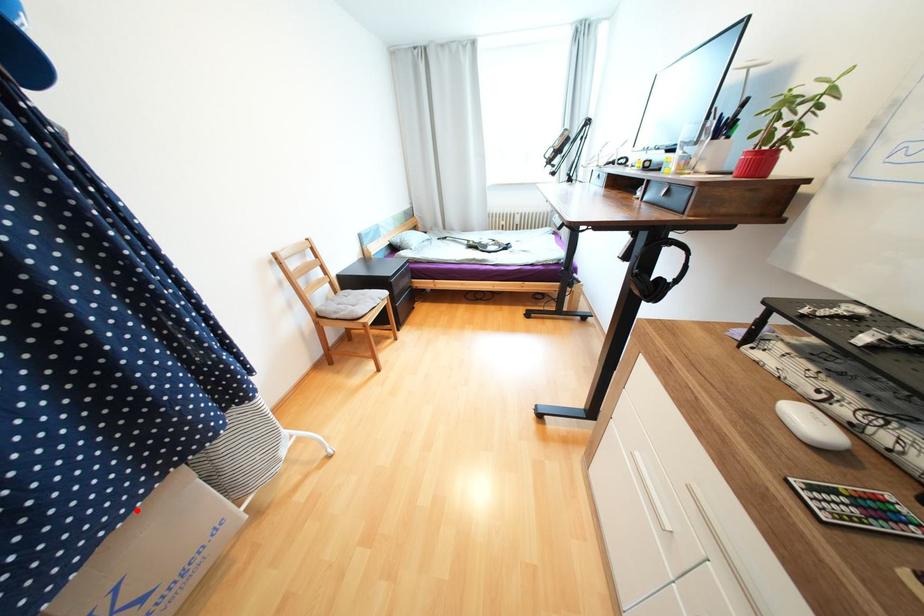
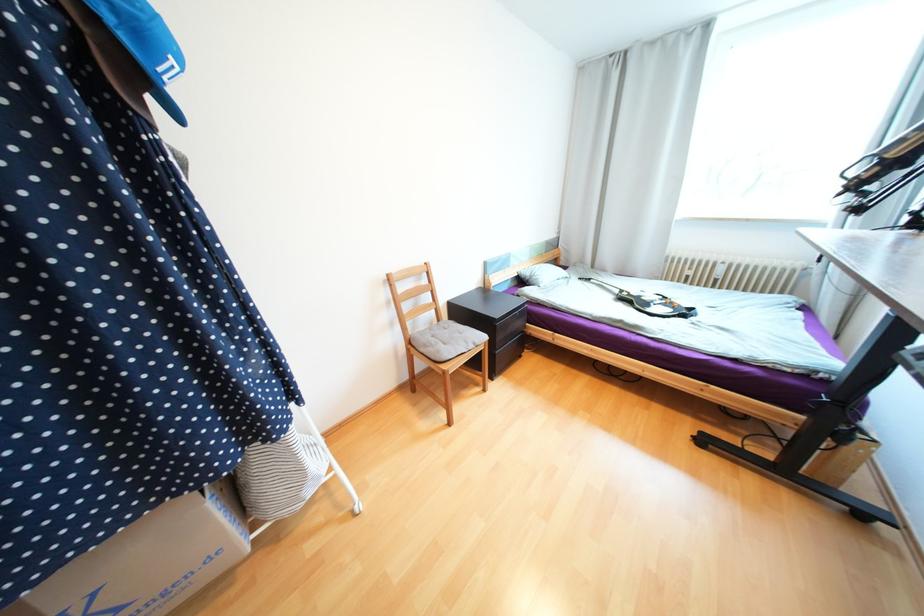
Locate, in the second image, the point that corresponds to the highlighted location in the first image.

(116, 535)